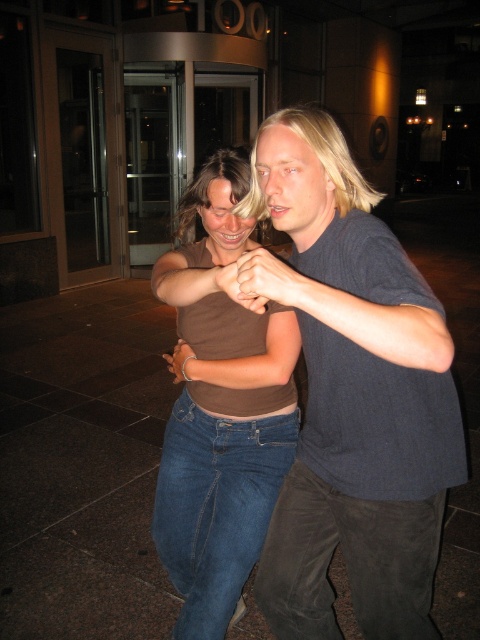
Question: Which object appears farthest from the camera in this image?

Choices:
 (A) brown cotton shirt at center
 (B) matte brown wristband at center
 (C) matte brown hand at center

Answer: (B)

Question: Which point appears closest to the camera in this image?

Choices:
 (A) (255, 266)
 (B) (268, 452)

Answer: (A)

Question: Can you confirm if brown matte shirt at center is positioned to the right of blue denim jeans at center?

Choices:
 (A) no
 (B) yes

Answer: (B)

Question: Is brown matte shirt at center in front of matte brown wristband at center?

Choices:
 (A) no
 (B) yes

Answer: (B)

Question: Does blue denim jeans at center appear under matte brown wristband at center?

Choices:
 (A) no
 (B) yes

Answer: (B)

Question: Among these points, which one is nearest to the camera?

Choices:
 (A) (228, 268)
 (B) (200, 186)
 (C) (219, 528)

Answer: (A)